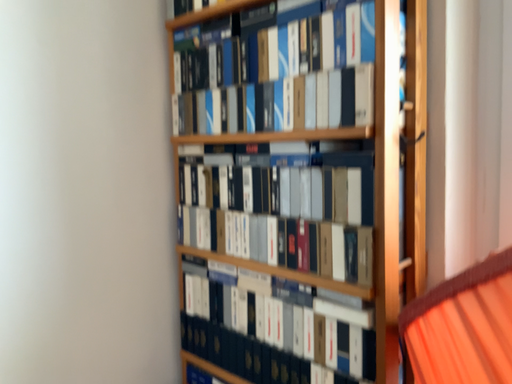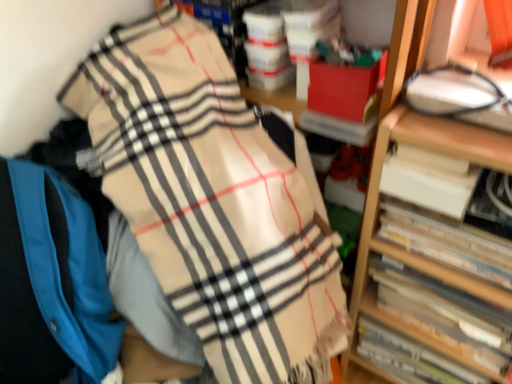
Question: How did the camera likely rotate when shooting the video?

Choices:
 (A) rotated downward
 (B) rotated upward

Answer: (A)